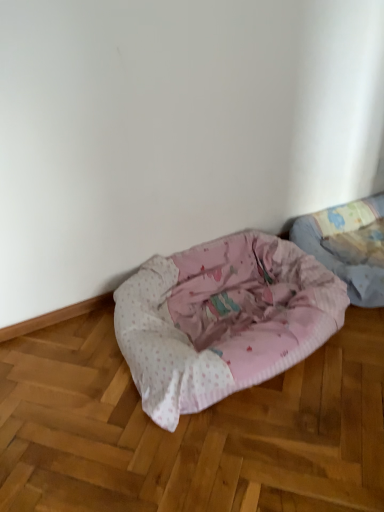
Locate an element on the screen. pink fabric dog bed at lower right, the 1th dog bed in the right-to-left sequence is located at coordinates (341, 252).

This screenshot has width=384, height=512. Describe the element at coordinates (341, 252) in the screenshot. I see `pink fabric dog bed at lower right, the 2th dog bed positioned from the left` at that location.

Where is `pink fabric dog bed at lower center, the 1th dog bed positioned from the left`? The width and height of the screenshot is (384, 512). pink fabric dog bed at lower center, the 1th dog bed positioned from the left is located at coordinates (222, 320).

The width and height of the screenshot is (384, 512). What do you see at coordinates (222, 320) in the screenshot? I see `pink fabric dog bed at lower center, the second dog bed viewed from the right` at bounding box center [222, 320].

Measure the distance between point (x=214, y=255) and camera.

6.47 feet.

Where is `pink fabric dog bed at lower right, the 1th dog bed in the right-to-left sequence`? pink fabric dog bed at lower right, the 1th dog bed in the right-to-left sequence is located at coordinates (341, 252).

Is pink fabric dog bed at lower right, the 1th dog bed in the right-to-left sequence, to the right of pink fabric dog bed at lower center, the second dog bed viewed from the right, from the viewer's perspective?

Yes, pink fabric dog bed at lower right, the 1th dog bed in the right-to-left sequence, is to the right of pink fabric dog bed at lower center, the second dog bed viewed from the right.

Which object is closer to the camera taking this photo, pink fabric dog bed at lower right, the 1th dog bed in the right-to-left sequence, or pink fabric dog bed at lower center, the second dog bed viewed from the right?

pink fabric dog bed at lower center, the second dog bed viewed from the right, is closer to the camera.

Does point (332, 248) appear closer or farther from the camera than point (188, 345)?

Point (332, 248) appears to be farther away from the viewer than point (188, 345).

From the image's perspective, which object appears higher, pink fabric dog bed at lower right, the 1th dog bed in the right-to-left sequence, or pink fabric dog bed at lower center, the 1th dog bed positioned from the left?

pink fabric dog bed at lower right, the 1th dog bed in the right-to-left sequence.

From a real-world perspective, does pink fabric dog bed at lower right, the 2th dog bed positioned from the left, sit lower than pink fabric dog bed at lower center, the second dog bed viewed from the right?

Indeed, from a real-world perspective, pink fabric dog bed at lower right, the 2th dog bed positioned from the left, is positioned beneath pink fabric dog bed at lower center, the second dog bed viewed from the right.

Can you confirm if pink fabric dog bed at lower right, the 1th dog bed in the right-to-left sequence, is wider than pink fabric dog bed at lower center, the 1th dog bed positioned from the left?

No.

In terms of height, does pink fabric dog bed at lower right, the 2th dog bed positioned from the left, look taller or shorter compared to pink fabric dog bed at lower center, the second dog bed viewed from the right?

In the image, pink fabric dog bed at lower right, the 2th dog bed positioned from the left, appears to be shorter than pink fabric dog bed at lower center, the second dog bed viewed from the right.

Who is smaller, pink fabric dog bed at lower right, the 2th dog bed positioned from the left, or pink fabric dog bed at lower center, the 1th dog bed positioned from the left?

Smaller between the two is pink fabric dog bed at lower right, the 2th dog bed positioned from the left.

Is pink fabric dog bed at lower right, the 2th dog bed positioned from the left, positioned beyond the bounds of pink fabric dog bed at lower center, the 1th dog bed positioned from the left?

Yes, pink fabric dog bed at lower right, the 2th dog bed positioned from the left, is outside of pink fabric dog bed at lower center, the 1th dog bed positioned from the left.

Are pink fabric dog bed at lower right, the 1th dog bed in the right-to-left sequence, and pink fabric dog bed at lower center, the second dog bed viewed from the right, located far from each other?

That's not correct — pink fabric dog bed at lower right, the 1th dog bed in the right-to-left sequence, is a little close to pink fabric dog bed at lower center, the second dog bed viewed from the right.

Is pink fabric dog bed at lower right, the 1th dog bed in the right-to-left sequence, oriented away from pink fabric dog bed at lower center, the second dog bed viewed from the right?

No, pink fabric dog bed at lower right, the 1th dog bed in the right-to-left sequence,'s orientation is not away from pink fabric dog bed at lower center, the second dog bed viewed from the right.

Find the location of a particular element. The image size is (384, 512). dog bed in front of the pink fabric dog bed at lower right, the 1th dog bed in the right-to-left sequence is located at coordinates (222, 320).

Is pink fabric dog bed at lower center, the second dog bed viewed from the right, to the left of pink fabric dog bed at lower right, the 1th dog bed in the right-to-left sequence, from the viewer's perspective?

Yes.

In the scene shown: Relative to pink fabric dog bed at lower right, the 1th dog bed in the right-to-left sequence, is pink fabric dog bed at lower center, the second dog bed viewed from the right, in front or behind?

Clearly, pink fabric dog bed at lower center, the second dog bed viewed from the right, is in front of pink fabric dog bed at lower right, the 1th dog bed in the right-to-left sequence.

Is point (280, 311) farther from camera compared to point (330, 253)?

No.

From the image's perspective, relative to pink fabric dog bed at lower right, the 1th dog bed in the right-to-left sequence, is pink fabric dog bed at lower center, the second dog bed viewed from the right, above or below?

pink fabric dog bed at lower center, the second dog bed viewed from the right, is below pink fabric dog bed at lower right, the 1th dog bed in the right-to-left sequence.

From a real-world perspective, which object stands above the other?

In real-world perspective, pink fabric dog bed at lower center, the 1th dog bed positioned from the left, is above.

Considering the sizes of pink fabric dog bed at lower center, the second dog bed viewed from the right, and pink fabric dog bed at lower right, the 1th dog bed in the right-to-left sequence, in the image, is pink fabric dog bed at lower center, the second dog bed viewed from the right, wider or thinner than pink fabric dog bed at lower right, the 1th dog bed in the right-to-left sequence,?

Clearly, pink fabric dog bed at lower center, the second dog bed viewed from the right, has more width compared to pink fabric dog bed at lower right, the 1th dog bed in the right-to-left sequence.

Can you confirm if pink fabric dog bed at lower center, the second dog bed viewed from the right, is shorter than pink fabric dog bed at lower right, the 1th dog bed in the right-to-left sequence?

No.

Can you confirm if pink fabric dog bed at lower center, the 1th dog bed positioned from the left, is smaller than pink fabric dog bed at lower right, the 2th dog bed positioned from the left?

No.

Is pink fabric dog bed at lower right, the 2th dog bed positioned from the left, completely or partially inside pink fabric dog bed at lower center, the 1th dog bed positioned from the left?

That's incorrect, pink fabric dog bed at lower right, the 2th dog bed positioned from the left, is not inside pink fabric dog bed at lower center, the 1th dog bed positioned from the left.

Would you say pink fabric dog bed at lower center, the 1th dog bed positioned from the left, is a long distance from pink fabric dog bed at lower right, the 1th dog bed in the right-to-left sequence?

No, pink fabric dog bed at lower center, the 1th dog bed positioned from the left, is not far from pink fabric dog bed at lower right, the 1th dog bed in the right-to-left sequence.

Could you tell me if pink fabric dog bed at lower center, the 1th dog bed positioned from the left, is turned towards pink fabric dog bed at lower right, the 2th dog bed positioned from the left?

No, pink fabric dog bed at lower center, the 1th dog bed positioned from the left, is not oriented towards pink fabric dog bed at lower right, the 2th dog bed positioned from the left.

How many degrees apart are the facing directions of pink fabric dog bed at lower center, the 1th dog bed positioned from the left, and pink fabric dog bed at lower right, the 1th dog bed in the right-to-left sequence?

There is a 0.000178-degree angle between the facing directions of pink fabric dog bed at lower center, the 1th dog bed positioned from the left, and pink fabric dog bed at lower right, the 1th dog bed in the right-to-left sequence.

The height and width of the screenshot is (512, 384). Find the location of `dog bed on the right of pink fabric dog bed at lower center, the 1th dog bed positioned from the left`. dog bed on the right of pink fabric dog bed at lower center, the 1th dog bed positioned from the left is located at coordinates (341, 252).

In the image, there is a pink fabric dog bed at lower right, the 2th dog bed positioned from the left. Where is `dog bed below it (from the image's perspective)`? This screenshot has width=384, height=512. dog bed below it (from the image's perspective) is located at coordinates (222, 320).

Identify the location of dog bed in front of the pink fabric dog bed at lower right, the 2th dog bed positioned from the left. (222, 320).